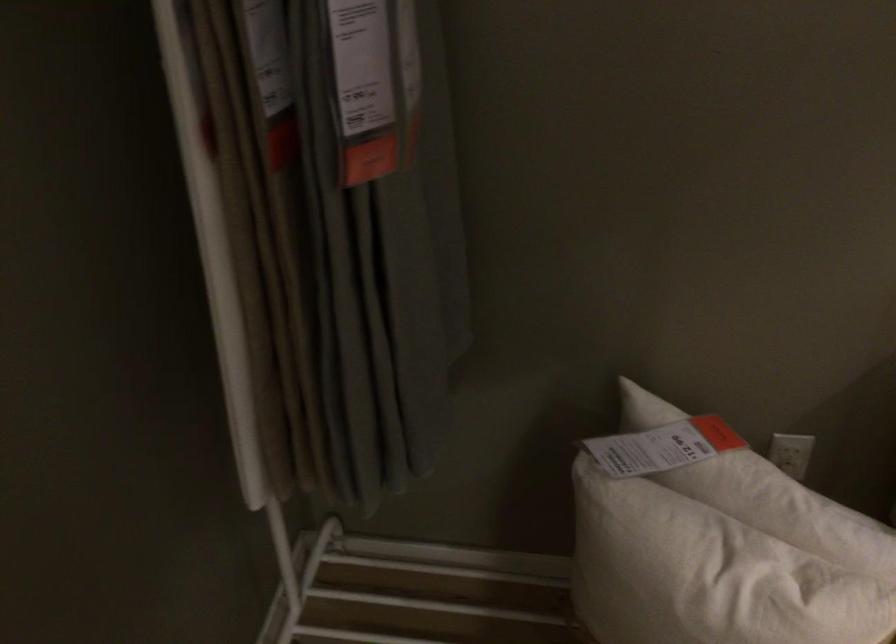
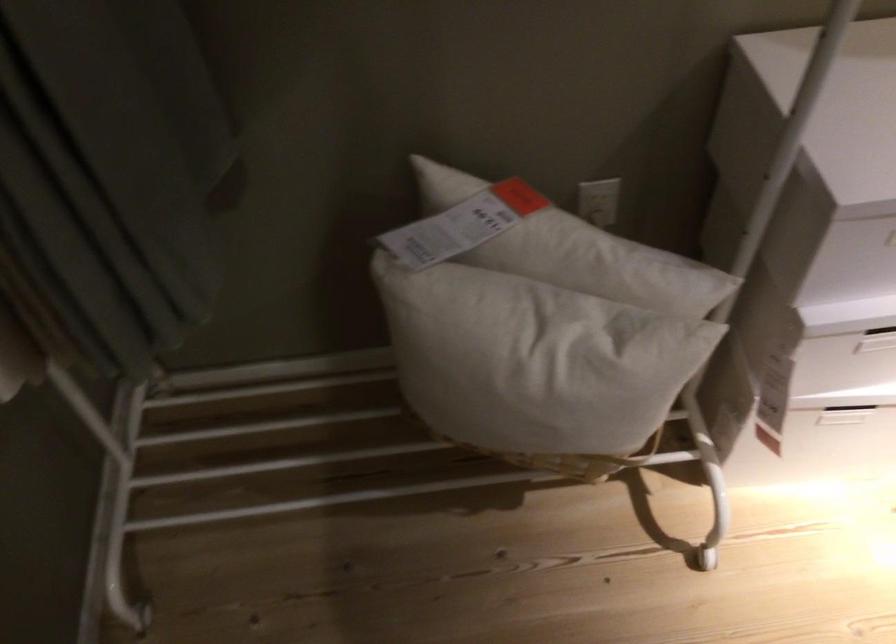
Which direction would the cameraman need to move to produce the second image?

The cameraman moved toward right, forward.